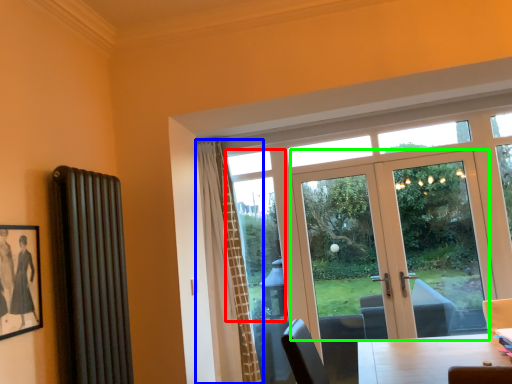
Question: Estimate the real-world distances between objects in this image. Which object is closer to window screen (highlighted by a red box), curtain (highlighted by a blue box) or door (highlighted by a green box)?

Choices:
 (A) curtain
 (B) door

Answer: (A)